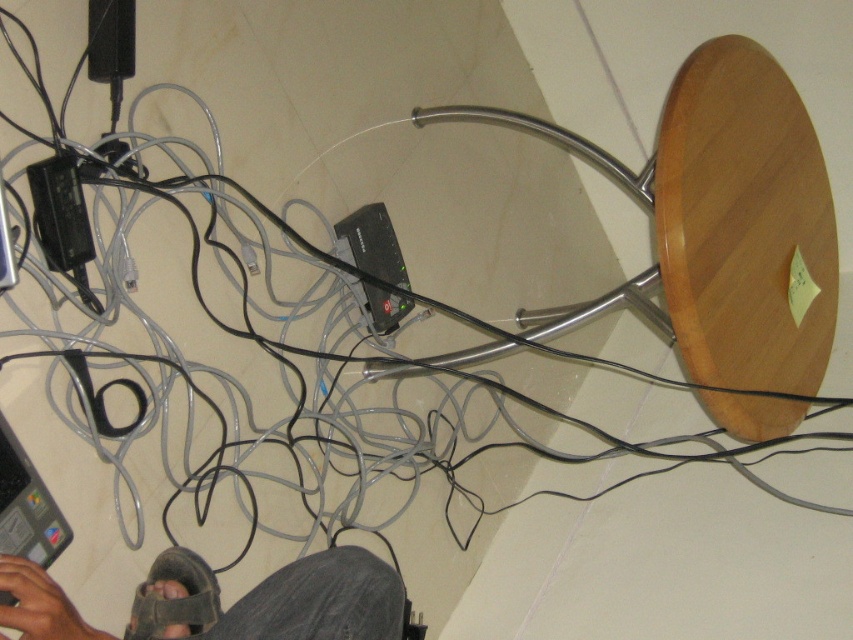
Is point (344, 547) less distant than point (375, 323)?

Yes, it is.

Who is lower down, gray fabric pants at lower center or black plastic router at center?

gray fabric pants at lower center

At what (x,y) coordinates should I click in order to perform the action: click on gray fabric pants at lower center. Please return your answer as a coordinate pair (x, y). The height and width of the screenshot is (640, 853). Looking at the image, I should click on (271, 600).

From the picture: Is black plastic plug at lower left to the left of black plastic router at center from the viewer's perspective?

Correct, you'll find black plastic plug at lower left to the left of black plastic router at center.

Does black plastic plug at lower left have a lesser width compared to black plastic router at center?

Indeed, black plastic plug at lower left has a lesser width compared to black plastic router at center.

Which is behind, point (33, 204) or point (355, 237)?

The point (355, 237) is more distant.

Where is `black plastic plug at lower left`? black plastic plug at lower left is located at coordinates (61, 212).

Does gray fabric pants at lower center have a greater height compared to black plastic plug at lower left?

Correct, gray fabric pants at lower center is much taller as black plastic plug at lower left.

Locate an element on the screen. This screenshot has height=640, width=853. gray fabric pants at lower center is located at coordinates (271, 600).

Image resolution: width=853 pixels, height=640 pixels. What are the coordinates of `gray fabric pants at lower center` in the screenshot? It's located at (271, 600).